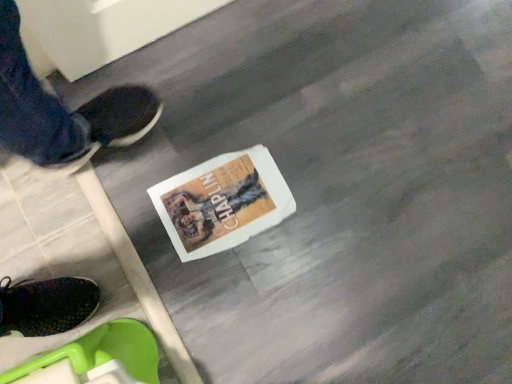
Identify the location of blank space situated above white paper magazine at center (from a real-world perspective). The height and width of the screenshot is (384, 512). (215, 198).